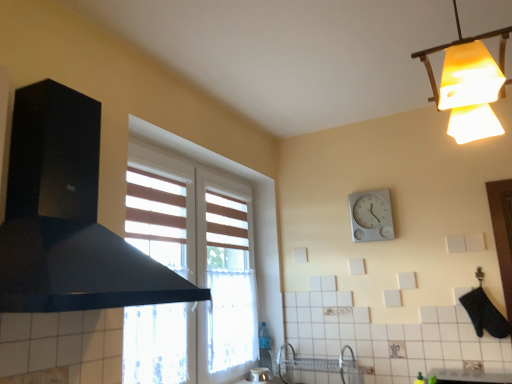
Question: From a real-world perspective, is black matte exhaust hood at left under yellow frosted glass lampshade at upper right?

Choices:
 (A) no
 (B) yes

Answer: (B)

Question: Is black matte exhaust hood at left touching yellow frosted glass lampshade at upper right?

Choices:
 (A) yes
 (B) no

Answer: (B)

Question: Is black matte exhaust hood at left taller than yellow frosted glass lampshade at upper right?

Choices:
 (A) no
 (B) yes

Answer: (B)

Question: Can you confirm if black matte exhaust hood at left is smaller than yellow frosted glass lampshade at upper right?

Choices:
 (A) yes
 (B) no

Answer: (B)

Question: Does black matte exhaust hood at left come in front of yellow frosted glass lampshade at upper right?

Choices:
 (A) yes
 (B) no

Answer: (A)

Question: From a real-world perspective, is black matte exhaust hood at left physically above yellow frosted glass lampshade at upper right?

Choices:
 (A) no
 (B) yes

Answer: (A)

Question: Is the depth of black matte exhaust hood at left greater than that of white plastic wall clock at upper center?

Choices:
 (A) no
 (B) yes

Answer: (A)

Question: Is black matte exhaust hood at left at the left side of white plastic wall clock at upper center?

Choices:
 (A) yes
 (B) no

Answer: (A)

Question: Is black matte exhaust hood at left turned away from white plastic wall clock at upper center?

Choices:
 (A) yes
 (B) no

Answer: (B)

Question: Is black matte exhaust hood at left closer to camera compared to white plastic wall clock at upper center?

Choices:
 (A) yes
 (B) no

Answer: (A)

Question: Considering the relative sizes of black matte exhaust hood at left and white plastic wall clock at upper center in the image provided, is black matte exhaust hood at left smaller than white plastic wall clock at upper center?

Choices:
 (A) yes
 (B) no

Answer: (B)

Question: Is black matte exhaust hood at left wider than white plastic wall clock at upper center?

Choices:
 (A) yes
 (B) no

Answer: (A)

Question: Considering the relative sizes of yellow frosted glass lampshade at upper right and white plastic wall clock at upper center in the image provided, is yellow frosted glass lampshade at upper right wider than white plastic wall clock at upper center?

Choices:
 (A) yes
 (B) no

Answer: (A)